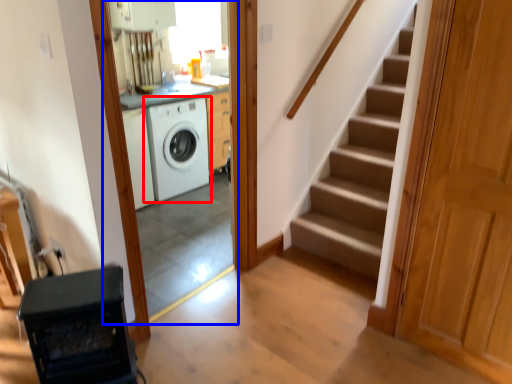
Question: Which of the following is the farthest to the observer, washing machine (highlighted by a red box) or screen door (highlighted by a blue box)?

Choices:
 (A) washing machine
 (B) screen door

Answer: (A)